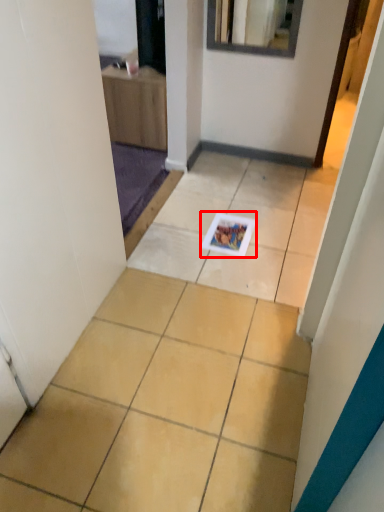
Question: From the image's perspective, where is magazine (annotated by the red box) located in relation to ceramic tile in the image?

Choices:
 (A) below
 (B) above

Answer: (B)